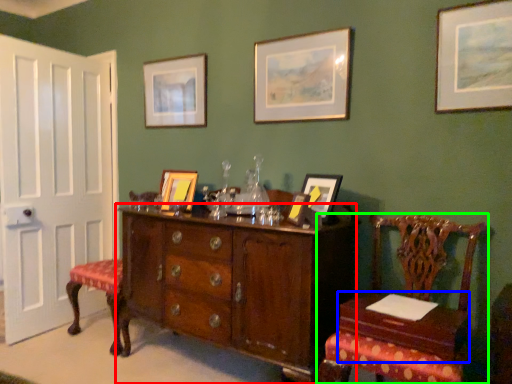
Question: Estimate the real-world distances between objects in this image. Which object is farther from cabinetry (highlighted by a red box), table (highlighted by a blue box) or chair (highlighted by a green box)?

Choices:
 (A) table
 (B) chair

Answer: (A)